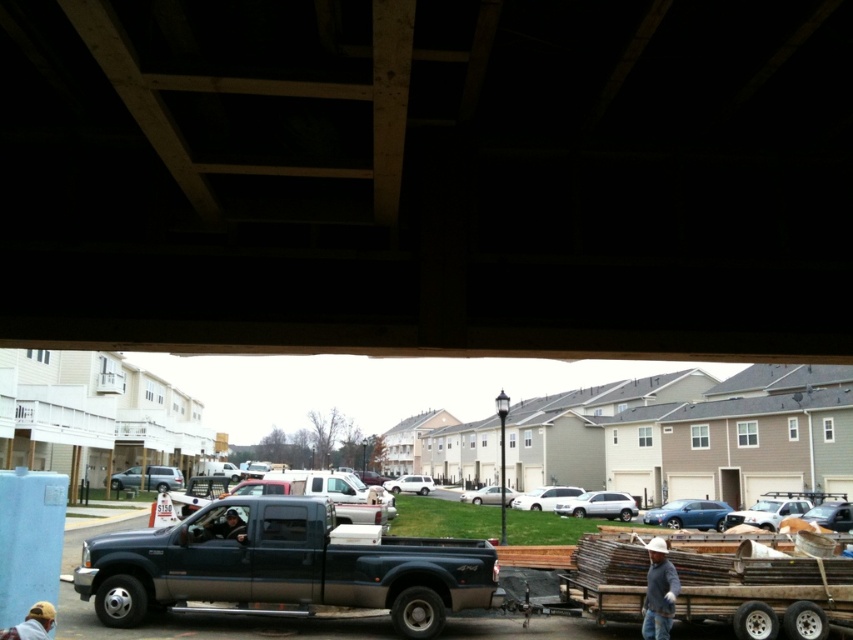
Based on the photo, you are a delivery driver who needs to park your truck near the wooden beams at upper center and the white hard hat at lower right. Which object is larger in size?

The wooden beams at upper center is bigger than white hard hat at lower right, so the wooden beams at upper center is larger in size.

You are standing under the bridge and looking out towards the residential area. There is a point marked at coordinates (428, 176). What object is located at this point?

The point at (428, 176) is on wooden beams at upper center.